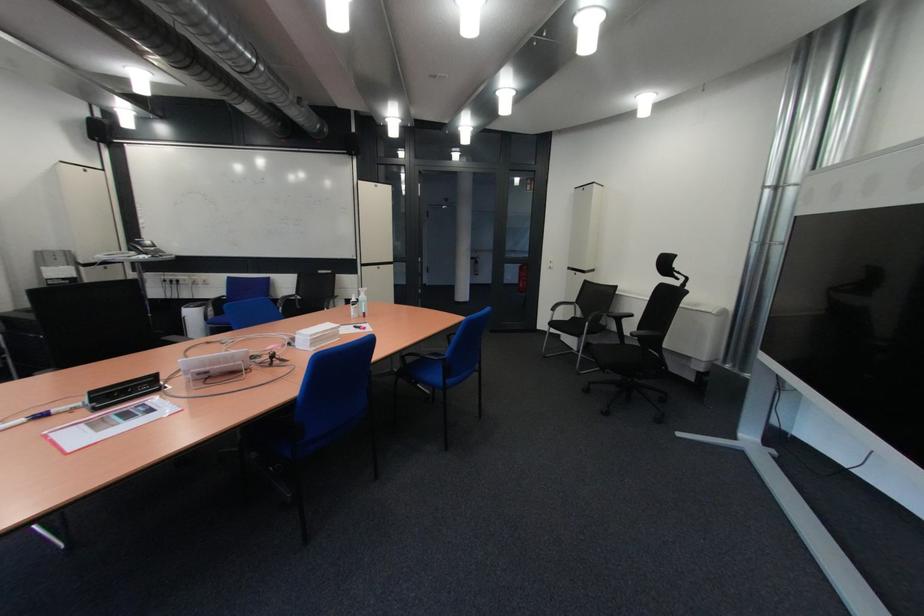
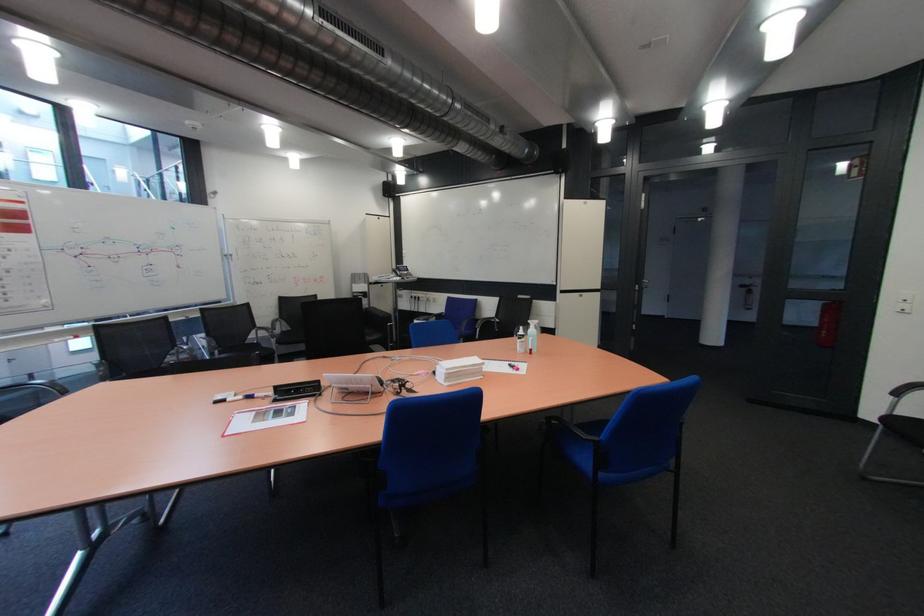
Question: Based on the continuous images, in which direction is the camera rotating? Reply with the corresponding letter.

Choices:
 (A) Left
 (B) Right
 (C) Up
 (D) Down

Answer: (A)